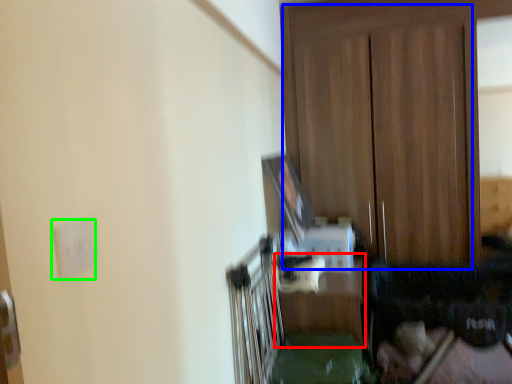
Question: Which is nearer to the table (highlighted by a red box)? dresser (highlighted by a blue box) or electric outlet (highlighted by a green box).

Choices:
 (A) dresser
 (B) electric outlet

Answer: (A)